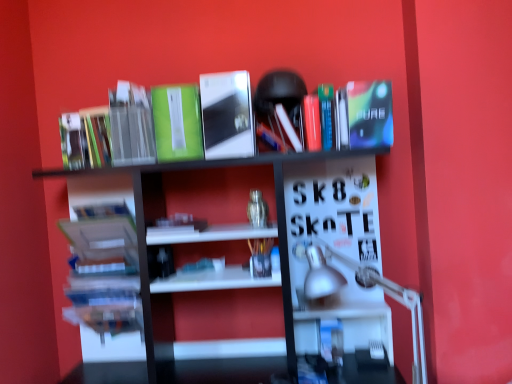
The image size is (512, 384). Describe the element at coordinates (227, 115) in the screenshot. I see `metallic silver book at center, the third paperback book viewed from the left` at that location.

What are the coordinates of `green matte book at upper left, which ranks as the third book in left-to-right order` in the screenshot? It's located at tap(97, 135).

How much space does shiny blue paperback at upper right, the fourth paperback book in the left-to-right sequence, occupy horizontally?

The width of shiny blue paperback at upper right, the fourth paperback book in the left-to-right sequence, is 30.06 centimeters.

At what (x,y) coordinates should I click in order to perform the action: click on green matte book at upper center, the third paperback book from the right. Please return your answer as a coordinate pair (x, y). The width and height of the screenshot is (512, 384). Looking at the image, I should click on (177, 123).

Image resolution: width=512 pixels, height=384 pixels. In order to click on hardcover books at left, which is the 4th book in right-to-left order in this screenshot , I will do `click(104, 270)`.

Where is `metallic silver book at center, the third paperback book viewed from the left`? Image resolution: width=512 pixels, height=384 pixels. metallic silver book at center, the third paperback book viewed from the left is located at coordinates (227, 115).

Which point is more distant from viewer, (110, 243) or (216, 148)?

The point (110, 243) is farther.

Is the position of hardcover books at left, positioned as the 2th book in left-to-right order, less distant than that of metallic silver book at center, which is counted as the second paperback book, starting from the right?

A: No, it is behind metallic silver book at center, which is counted as the second paperback book, starting from the right.

How much distance is there between hardcover books at left, positioned as the 2th book in left-to-right order, and metallic silver book at center, the third paperback book viewed from the left?

A distance of 27.01 inches exists between hardcover books at left, positioned as the 2th book in left-to-right order, and metallic silver book at center, the third paperback book viewed from the left.

How many degrees apart are the facing directions of hardcover books at left, positioned as the 2th book in left-to-right order, and metallic silver book at center, which is counted as the second paperback book, starting from the right?

The angle between the facing direction of hardcover books at left, positioned as the 2th book in left-to-right order, and the facing direction of metallic silver book at center, which is counted as the second paperback book, starting from the right, is 0.000102 degrees.

Which is behind, matte green book at upper left, the first book when ordered from left to right, or metallic silver book at center, the third paperback book viewed from the left?

matte green book at upper left, the first book when ordered from left to right.

Could you tell me if matte green book at upper left, which is counted as the 5th book, starting from the right, is turned towards metallic silver book at center, the third paperback book viewed from the left?

No, matte green book at upper left, which is counted as the 5th book, starting from the right, does not turn towards metallic silver book at center, the third paperback book viewed from the left.

The width and height of the screenshot is (512, 384). In order to click on paperback book that is the 3rd object above the matte green book at upper left, the first book when ordered from left to right (from a real-world perspective) in this screenshot , I will do `click(227, 115)`.

How far apart are matte green book at upper left, the first book when ordered from left to right, and metallic silver book at center, the third paperback book viewed from the left?

matte green book at upper left, the first book when ordered from left to right, and metallic silver book at center, the third paperback book viewed from the left, are 24.36 inches apart from each other.

Considering the positions of points (91, 139) and (161, 130), is point (91, 139) farther from camera compared to point (161, 130)?

Yes, it is behind point (161, 130).

Considering the relative sizes of green matte book at upper left, the 3th book positioned from the right, and green matte book at upper center, the third paperback book from the right, in the image provided, is green matte book at upper left, the 3th book positioned from the right, wider than green matte book at upper center, the third paperback book from the right,?

Incorrect, the width of green matte book at upper left, the 3th book positioned from the right, does not surpass that of green matte book at upper center, the third paperback book from the right.

Is green matte book at upper left, which ranks as the third book in left-to-right order, taller than green matte book at upper center, which ranks as the 2th paperback book in left-to-right order?

No, green matte book at upper left, which ranks as the third book in left-to-right order, is not taller than green matte book at upper center, which ranks as the 2th paperback book in left-to-right order.

From a real-world perspective, which is physically above, green matte book at upper left, the 3th book positioned from the right, or green matte book at upper center, which ranks as the 2th paperback book in left-to-right order?

green matte book at upper center, which ranks as the 2th paperback book in left-to-right order, is physically above.

From the image's perspective, does matte green book at upper left, which is counted as the 5th book, starting from the right, appear higher than green matte book at upper center, the third paperback book from the right?

No, from the image's perspective, matte green book at upper left, which is counted as the 5th book, starting from the right, is not above green matte book at upper center, the third paperback book from the right.

In terms of height, does matte green book at upper left, which is counted as the 5th book, starting from the right, look taller or shorter compared to green matte book at upper center, which ranks as the 2th paperback book in left-to-right order?

matte green book at upper left, which is counted as the 5th book, starting from the right, is shorter than green matte book at upper center, which ranks as the 2th paperback book in left-to-right order.

What's the angular difference between matte green book at upper left, the first book when ordered from left to right, and green matte book at upper center, the third paperback book from the right,'s facing directions?

They differ by 0.00027 degrees in their facing directions.

Would you consider matte green book at upper left, the first book when ordered from left to right, to be distant from green matte book at upper center, which ranks as the 2th paperback book in left-to-right order?

matte green book at upper left, the first book when ordered from left to right, is near green matte book at upper center, which ranks as the 2th paperback book in left-to-right order, not far away.

Is silver metallic table lamp at lower right thinner than metallic silver book at center, the third paperback book viewed from the left?

No, silver metallic table lamp at lower right is not thinner than metallic silver book at center, the third paperback book viewed from the left.

Is silver metallic table lamp at lower right taller or shorter than metallic silver book at center, the third paperback book viewed from the left?

Clearly, silver metallic table lamp at lower right is taller compared to metallic silver book at center, the third paperback book viewed from the left.

Looking at this image, which object is further away from the camera taking this photo, silver metallic table lamp at lower right or metallic silver book at center, which is counted as the second paperback book, starting from the right?

Positioned behind is metallic silver book at center, which is counted as the second paperback book, starting from the right.

Does green matte book at upper center, which ranks as the 2th paperback book in left-to-right order, appear on the left side of white matte book at center, arranged as the 4th book when viewed from the left?

In fact, green matte book at upper center, which ranks as the 2th paperback book in left-to-right order, is to the right of white matte book at center, arranged as the 4th book when viewed from the left.

Based on their sizes in the image, would you say green matte book at upper center, the third paperback book from the right, is bigger or smaller than white matte book at center, which appears as the 2th book when viewed from the right?

green matte book at upper center, the third paperback book from the right, is bigger than white matte book at center, which appears as the 2th book when viewed from the right.

Is green matte book at upper center, which ranks as the 2th paperback book in left-to-right order, turned away from white matte book at center, which appears as the 2th book when viewed from the right?

No, green matte book at upper center, which ranks as the 2th paperback book in left-to-right order, is not facing away from white matte book at center, which appears as the 2th book when viewed from the right.

Locate an element on the screen. The width and height of the screenshot is (512, 384). the 1st paperback book to the right of the white matte book at center, arranged as the 4th book when viewed from the left, counting from the anchor's position is located at coordinates (177, 123).

Between green matte book at upper left, positioned as the fourth paperback book in right-to-left order, and shiny blue paperback at upper right, the fourth paperback book in the left-to-right sequence, which one has less height?

shiny blue paperback at upper right, the fourth paperback book in the left-to-right sequence, is shorter.

Visually, is green matte book at upper left, which appears as the 1th paperback book when viewed from the left, positioned to the left or to the right of shiny blue paperback at upper right, the fourth paperback book in the left-to-right sequence?

green matte book at upper left, which appears as the 1th paperback book when viewed from the left, is positioned on shiny blue paperback at upper right, the fourth paperback book in the left-to-right sequence,'s left side.

Between green matte book at upper left, positioned as the fourth paperback book in right-to-left order, and shiny blue paperback at upper right, the fourth paperback book in the left-to-right sequence, which one has smaller width?

green matte book at upper left, positioned as the fourth paperback book in right-to-left order.

From the image's perspective, does green matte book at upper left, which appears as the 1th paperback book when viewed from the left, appear higher than shiny blue paperback at upper right, which appears as the 1th paperback book when viewed from the right?

No.

At what (x,y) coordinates should I click in order to perform the action: click on the 3rd paperback book to the right of the hardcover books at left, positioned as the 2th book in left-to-right order, counting from the anchor's position. Please return your answer as a coordinate pair (x, y). Image resolution: width=512 pixels, height=384 pixels. Looking at the image, I should click on (227, 115).

Image resolution: width=512 pixels, height=384 pixels. I want to click on book that is the 4th one when counting leftward from the metallic silver book at center, which is counted as the second paperback book, starting from the right, so click(73, 141).

Considering their positions, is green matte book at upper left, which ranks as the third book in left-to-right order, positioned closer to green matte book at upper center, the third paperback book from the right, than white glossy bookshelf at upper center?

Among the two, white glossy bookshelf at upper center is located nearer to green matte book at upper center, the third paperback book from the right.

From the image, which object appears to be nearer to metallic silver book at center, which is counted as the second paperback book, starting from the right, translucent plastic pen holder at center, which appears as the 5th book when viewed from the left, or hardcover books at left, positioned as the 2th book in left-to-right order?

translucent plastic pen holder at center, which appears as the 5th book when viewed from the left.

From the image, which object appears to be nearer to green matte book at upper left, the 3th book positioned from the right, white glossy bookshelf at upper center or silver metallic table lamp at lower right?

white glossy bookshelf at upper center is positioned closer to the anchor green matte book at upper left, the 3th book positioned from the right.

Which object lies nearer to the anchor point white matte book at center, which appears as the 2th book when viewed from the right, metallic silver book at center, the third paperback book viewed from the left, or translucent plastic pen holder at center, which appears as the 5th book when viewed from the left?

translucent plastic pen holder at center, which appears as the 5th book when viewed from the left, is positioned closer to the anchor white matte book at center, which appears as the 2th book when viewed from the right.

From the image, which object appears to be nearer to green matte book at upper center, which ranks as the 2th paperback book in left-to-right order, white glossy bookshelf at upper center or green matte book at upper left, the 3th book positioned from the right?

white glossy bookshelf at upper center.

Based on their spatial positions, is silver metallic table lamp at lower right or green matte book at upper center, the third paperback book from the right, further from matte green book at upper left, which is counted as the 5th book, starting from the right?

The object further to matte green book at upper left, which is counted as the 5th book, starting from the right, is silver metallic table lamp at lower right.

From the image, which object appears to be nearer to hardcover books at left, which is the 4th book in right-to-left order, green matte book at upper center, the third paperback book from the right, or shiny blue paperback at upper right, the fourth paperback book in the left-to-right sequence?

green matte book at upper center, the third paperback book from the right.

Based on their spatial positions, is translucent plastic pen holder at center, which appears as the 1th book when viewed from the right, or green matte book at upper left, which ranks as the third book in left-to-right order, further from green matte book at upper left, positioned as the fourth paperback book in right-to-left order?

Among the two, translucent plastic pen holder at center, which appears as the 1th book when viewed from the right, is located further to green matte book at upper left, positioned as the fourth paperback book in right-to-left order.

At what (x,y) coordinates should I click in order to perform the action: click on book between white glossy bookshelf at upper center and white matte book at center, arranged as the 4th book when viewed from the left, from front to back. Please return your answer as a coordinate pair (x, y). The image size is (512, 384). Looking at the image, I should click on (260, 257).

In order to click on paperback book that lies between green matte book at upper center, the third paperback book from the right, and white glossy bookshelf at upper center from top to bottom in this screenshot , I will do `click(131, 125)`.

I want to click on shelf that lies between shiny blue paperback at upper right, the fourth paperback book in the left-to-right sequence, and silver metallic table lamp at lower right from top to bottom, so click(166, 209).

Identify the location of shelf located between green matte book at upper left, positioned as the fourth paperback book in right-to-left order, and silver metallic table lamp at lower right in the left-right direction. (166, 209).